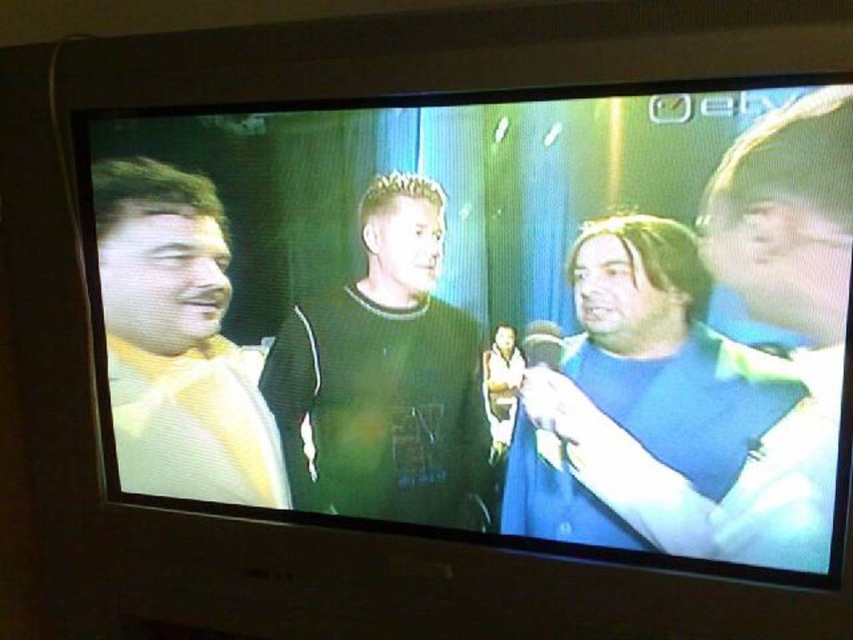
Question: Is blue matte shirt at right to the right of dark green sweater at center from the viewer's perspective?

Choices:
 (A) yes
 (B) no

Answer: (A)

Question: Is dark green sweater at center further to camera compared to yellow fabric shirt at left?

Choices:
 (A) yes
 (B) no

Answer: (B)

Question: Which point is farther from the camera taking this photo?

Choices:
 (A) (200, 428)
 (B) (786, 253)
 (C) (419, 275)

Answer: (A)

Question: Which point is farther from the camera taking this photo?

Choices:
 (A) (119, 416)
 (B) (171, 486)

Answer: (A)

Question: Is matte black shirt at center positioned in front of yellow fabric shirt at left?

Choices:
 (A) yes
 (B) no

Answer: (A)

Question: Among these objects, which one is farthest from the camera?

Choices:
 (A) blue matte shirt at right
 (B) yellow fabric shirt at left

Answer: (B)